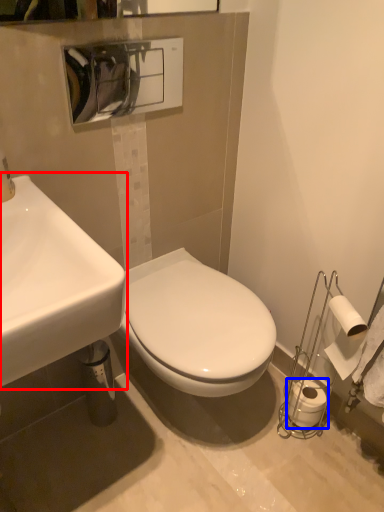
Question: Which point is closer to the camera, sink (highlighted by a red box) or toilet paper (highlighted by a blue box)?

Choices:
 (A) sink
 (B) toilet paper

Answer: (A)